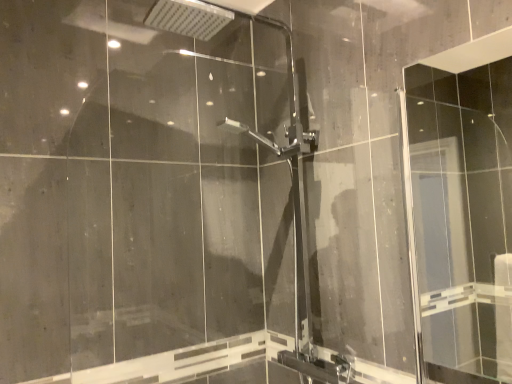
The width and height of the screenshot is (512, 384). What do you see at coordinates (461, 208) in the screenshot? I see `transparent glass screen door at upper right` at bounding box center [461, 208].

Find the location of a particular element. This screenshot has width=512, height=384. transparent glass screen door at upper right is located at coordinates (461, 208).

The height and width of the screenshot is (384, 512). What are the coordinates of `transparent glass screen door at upper right` in the screenshot? It's located at (461, 208).